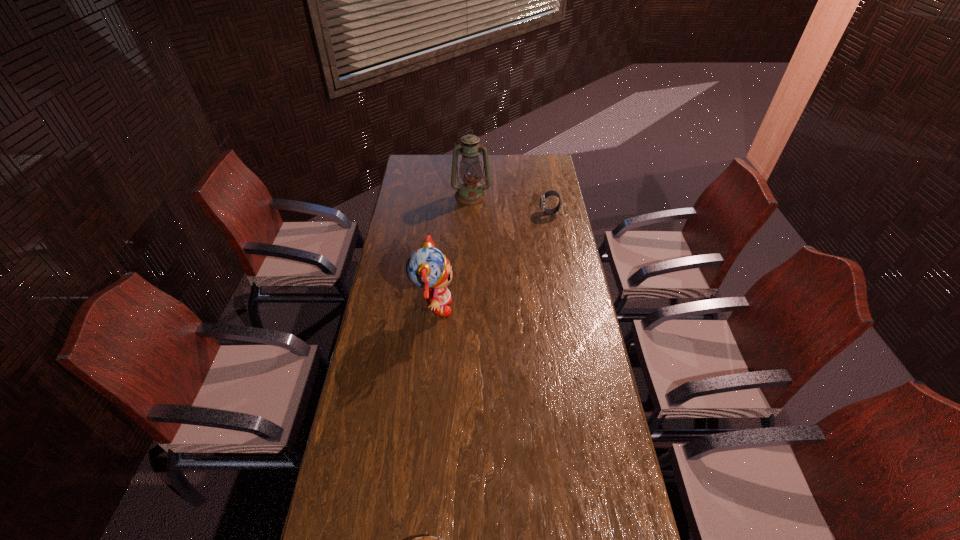
Locate an element on the screen. This screenshot has height=540, width=960. vacant space situated on the face of the third nearest object is located at coordinates (474, 213).

The width and height of the screenshot is (960, 540). I want to click on object located in the left edge section of the desktop, so click(427, 267).

Locate an element on the screen. Image resolution: width=960 pixels, height=540 pixels. object located in the right edge section of the desktop is located at coordinates (549, 193).

This screenshot has height=540, width=960. In order to click on free spot at the far edge of the desktop in this screenshot , I will do `click(521, 164)`.

Locate an element on the screen. free space at the left edge is located at coordinates (410, 242).

Where is `free region at the right edge`? This screenshot has height=540, width=960. free region at the right edge is located at coordinates (564, 208).

In the image, there is a desktop. Where is `vacant space at the far left corner`? vacant space at the far left corner is located at coordinates (416, 177).

Where is `unoccupied position between the second tallest object and the third nearest object`? This screenshot has height=540, width=960. unoccupied position between the second tallest object and the third nearest object is located at coordinates (492, 260).

Locate an element on the screen. The width and height of the screenshot is (960, 540). free spot between the third nearest object and the doll is located at coordinates (492, 260).

Find the location of a particular element. This screenshot has height=540, width=960. unoccupied position between the watch and the tallest object is located at coordinates (x=511, y=204).